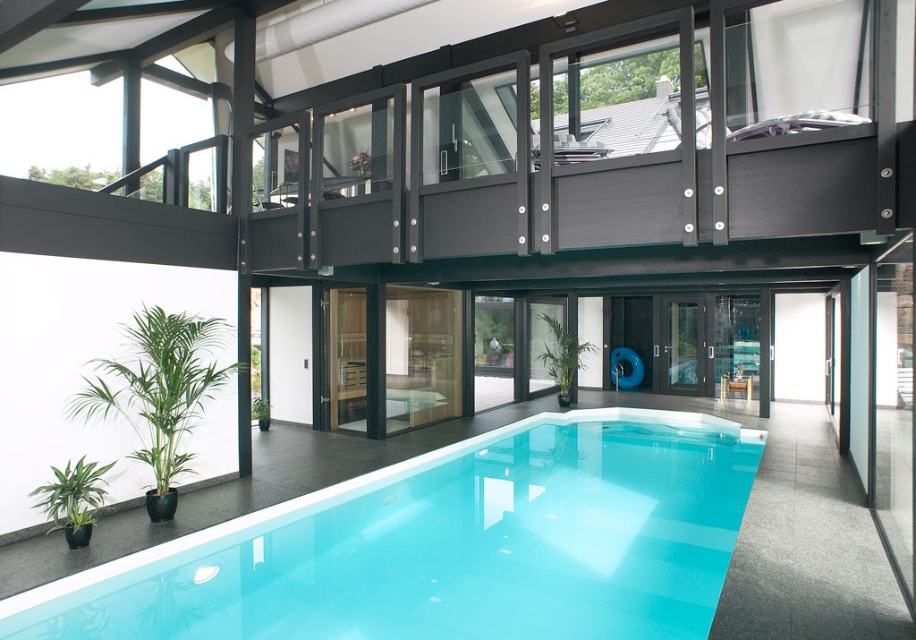
Based on the photo, between green glossy plant at lower left and green glossy plant at center, which one has less height?

green glossy plant at lower left

Between green glossy plant at lower left and green glossy plant at center, which one is positioned lower?

green glossy plant at lower left is below.

Who is more forward, (84, 464) or (573, 332)?

Point (84, 464) is more forward.

The width and height of the screenshot is (916, 640). Identify the location of green glossy plant at lower left. (73, 499).

Is green leafy plant at lower left to the left of green glossy plant at lower left from the viewer's perspective?

In fact, green leafy plant at lower left is to the right of green glossy plant at lower left.

Who is taller, green leafy plant at lower left or green glossy plant at lower left?

green leafy plant at lower left is taller.

Who is more distant from viewer, (159,385) or (79,476)?

The point (159,385) is behind.

The height and width of the screenshot is (640, 916). I want to click on green leafy plant at lower left, so click(x=159, y=387).

Who is taller, clear acrylic pool at lower center or green leafy plant at lower left?

green leafy plant at lower left

Measure the distance from clear acrylic pool at lower center to green leafy plant at lower left.

4.83 feet

Is point (290, 504) behind point (121, 394)?

Yes, it is behind point (121, 394).

I want to click on clear acrylic pool at lower center, so click(x=450, y=545).